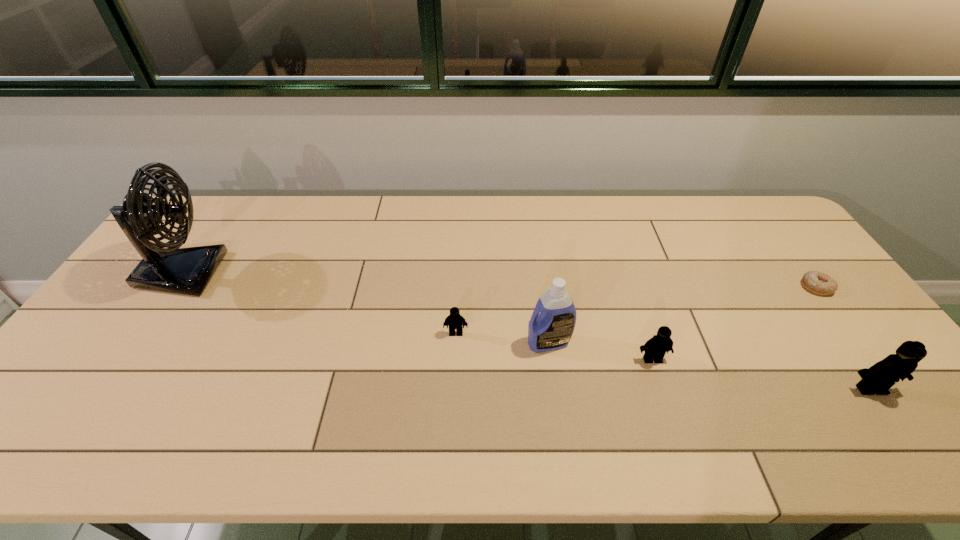
Identify the location of object that is at the near right corner. (878, 379).

Locate an element on the screen. This screenshot has height=540, width=960. free space at the far edge is located at coordinates (712, 238).

Find the location of a particular element. The width and height of the screenshot is (960, 540). free point at the near edge is located at coordinates (500, 392).

I want to click on free space at the left edge, so click(x=132, y=288).

In the image, there is a desktop. Find the location of `vacant region at the right edge`. vacant region at the right edge is located at coordinates (825, 324).

Find the location of a particular element. This screenshot has height=540, width=960. vacant space at the far left corner of the desktop is located at coordinates (212, 219).

Locate an element on the screen. Image resolution: width=960 pixels, height=540 pixels. vacant space at the near right corner of the desktop is located at coordinates (924, 403).

Find the location of a particular element. This screenshot has width=960, height=540. vacant area between the fan and the shortest object is located at coordinates (499, 280).

Where is `unoccupied position between the shortest Lego and the shortest object`? Image resolution: width=960 pixels, height=540 pixels. unoccupied position between the shortest Lego and the shortest object is located at coordinates (636, 310).

Find the location of a particular element. Image resolution: width=960 pixels, height=540 pixels. free space between the third object from left to right and the tallest object is located at coordinates (365, 308).